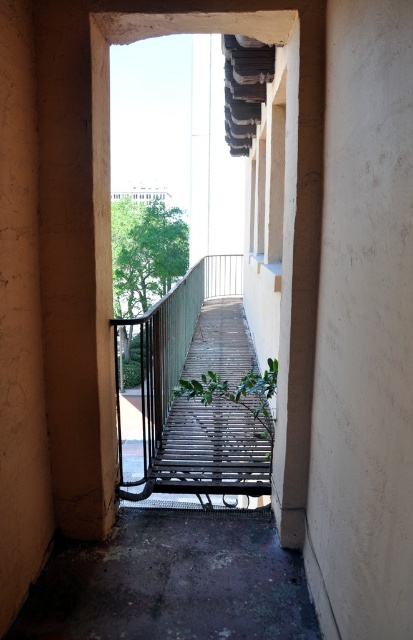
I want to click on white smooth wall at center, so click(363, 330).

Who is more forward, (x=386, y=241) or (x=30, y=65)?

Positioned in front is point (x=386, y=241).

Locate an element on the screen. The image size is (413, 640). white smooth wall at center is located at coordinates (363, 330).